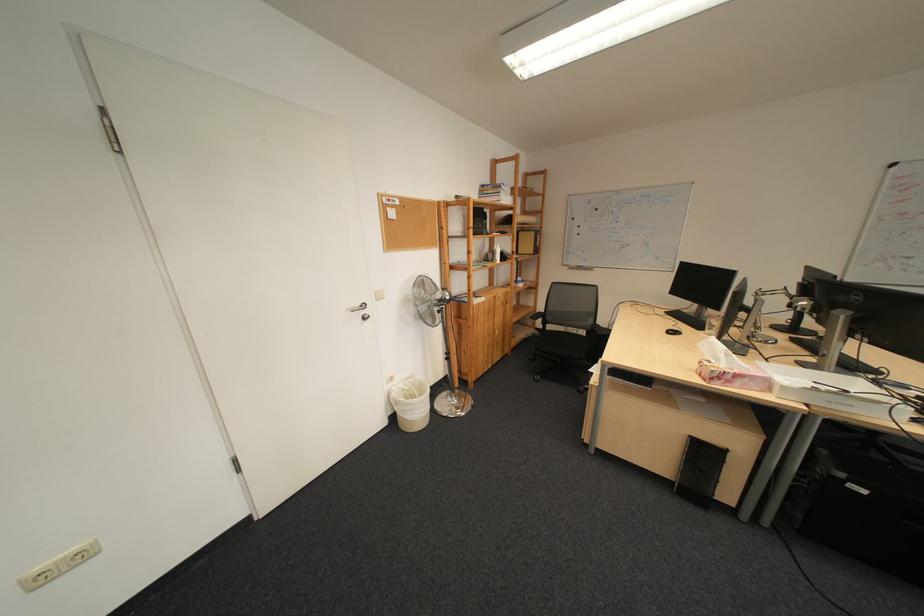
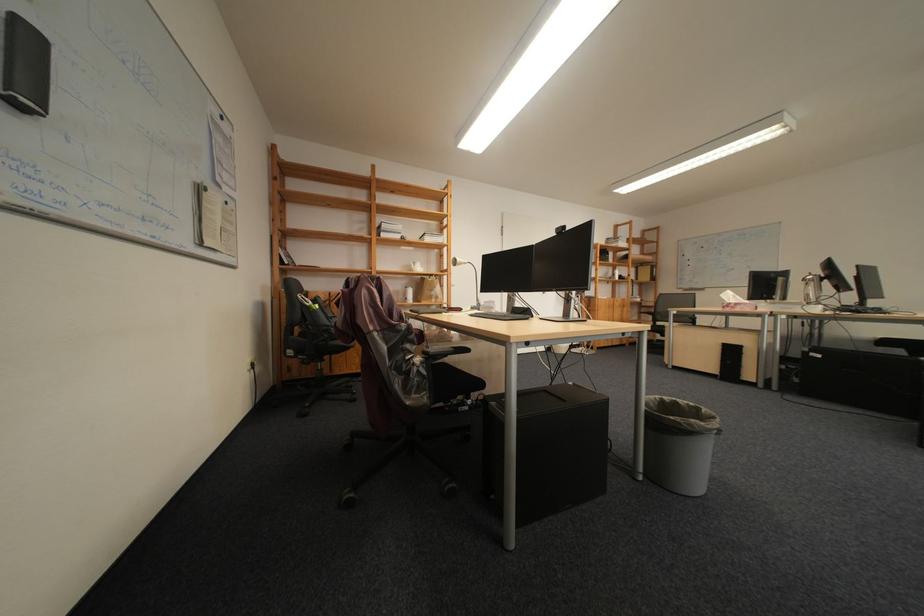
The point at (x=743, y=383) is marked in the first image. Where is the corresponding point in the second image?

(747, 309)